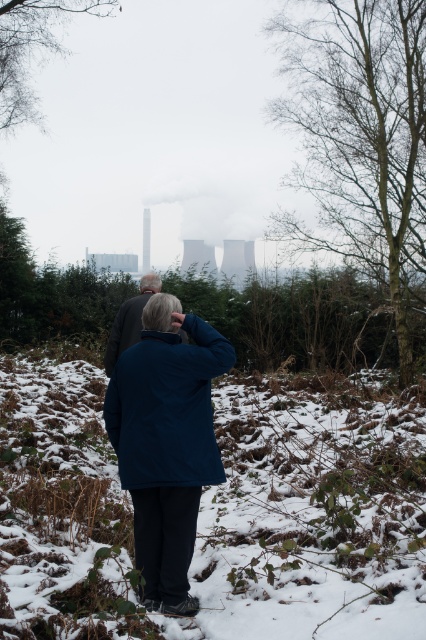
Question: Which object is the farthest from the blue fabric jacket at center?

Choices:
 (A) dark blue jacket at center
 (B) bare branches at upper left

Answer: (B)

Question: Does bare wood tree at right appear on the left side of dark blue jacket at center?

Choices:
 (A) yes
 (B) no

Answer: (B)

Question: Which point is closer to the camera?

Choices:
 (A) bare wood tree at right
 (B) dark blue jacket at center
 (C) white fluffy snow at center

Answer: (C)

Question: Can you confirm if bare wood tree at right is positioned below bare branches at upper left?

Choices:
 (A) yes
 (B) no

Answer: (A)

Question: Which object is positioned farthest from the blue fabric jacket at center?

Choices:
 (A) bare wood tree at right
 (B) white fluffy snow at center

Answer: (A)

Question: Does blue fabric jacket at center appear under dark blue jacket at center?

Choices:
 (A) no
 (B) yes

Answer: (B)